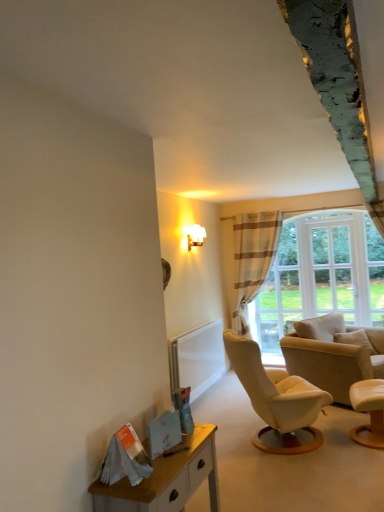
Question: Is wooden desk at lower left next to beige leather chair at right, arranged as the 2th chair when viewed from the front?

Choices:
 (A) yes
 (B) no

Answer: (B)

Question: From the image's perspective, would you say wooden desk at lower left is shown under beige leather chair at right, the first chair in the back-to-front sequence?

Choices:
 (A) no
 (B) yes

Answer: (B)

Question: Is wooden desk at lower left to the left of beige leather chair at right, arranged as the 2th chair when viewed from the front, from the viewer's perspective?

Choices:
 (A) no
 (B) yes

Answer: (B)

Question: From a real-world perspective, is wooden desk at lower left positioned under beige leather chair at right, the first chair in the back-to-front sequence, based on gravity?

Choices:
 (A) yes
 (B) no

Answer: (B)

Question: From a real-world perspective, is wooden desk at lower left over beige leather chair at right, the first chair in the back-to-front sequence?

Choices:
 (A) yes
 (B) no

Answer: (A)

Question: Is white frosted glass wall sconce at upper center inside or outside of striped fabric curtain at center?

Choices:
 (A) inside
 (B) outside

Answer: (B)

Question: Does point (203, 231) appear closer or farther from the camera than point (243, 258)?

Choices:
 (A) closer
 (B) farther

Answer: (A)

Question: From the image's perspective, relative to striped fabric curtain at center, is white frosted glass wall sconce at upper center above or below?

Choices:
 (A) below
 (B) above

Answer: (B)

Question: Is white frosted glass wall sconce at upper center taller or shorter than striped fabric curtain at center?

Choices:
 (A) tall
 (B) short

Answer: (B)

Question: From a real-world perspective, is white frosted glass wall sconce at upper center above or below smooth beige armchair at lower right, placed as the 2th chair when sorted from back to front?

Choices:
 (A) above
 (B) below

Answer: (A)

Question: Considering the positions of white frosted glass wall sconce at upper center and smooth beige armchair at lower right, placed as the 2th chair when sorted from back to front, in the image, is white frosted glass wall sconce at upper center bigger or smaller than smooth beige armchair at lower right, placed as the 2th chair when sorted from back to front,?

Choices:
 (A) small
 (B) big

Answer: (A)

Question: Is white frosted glass wall sconce at upper center in front of or behind smooth beige armchair at lower right, placed as the 2th chair when sorted from back to front, in the image?

Choices:
 (A) front
 (B) behind

Answer: (B)

Question: In terms of height, does white frosted glass wall sconce at upper center look taller or shorter compared to smooth beige armchair at lower right, which is counted as the first chair, starting from the front?

Choices:
 (A) short
 (B) tall

Answer: (A)

Question: From the image's perspective, is striped fabric curtain at center positioned above or below white glass window at upper right?

Choices:
 (A) below
 (B) above

Answer: (A)

Question: Does point (258, 240) appear closer or farther from the camera than point (342, 262)?

Choices:
 (A) farther
 (B) closer

Answer: (A)